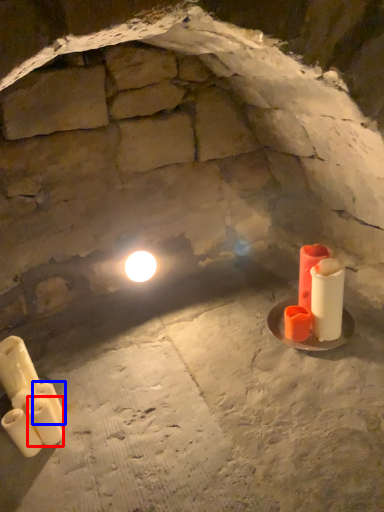
Question: Which object appears farthest to the camera in this image, candle (highlighted by a red box) or candle (highlighted by a blue box)?

Choices:
 (A) candle
 (B) candle

Answer: (B)